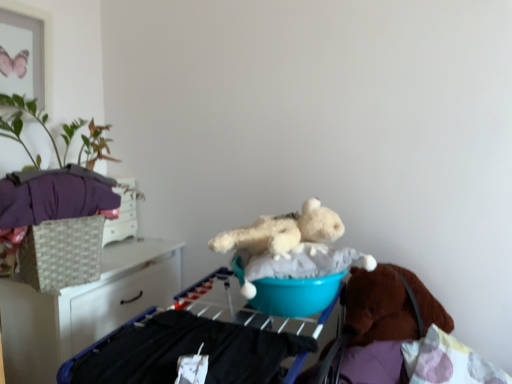
Question: Is teal plastic bucket at center a part of blue plastic basin at center?

Choices:
 (A) no
 (B) yes

Answer: (A)

Question: Is blue plastic basin at center beside teal plastic bucket at center?

Choices:
 (A) yes
 (B) no

Answer: (B)

Question: Considering the relative sizes of blue plastic basin at center and teal plastic bucket at center in the image provided, is blue plastic basin at center bigger than teal plastic bucket at center?

Choices:
 (A) yes
 (B) no

Answer: (B)

Question: Are blue plastic basin at center and teal plastic bucket at center located far from each other?

Choices:
 (A) yes
 (B) no

Answer: (B)

Question: From the image's perspective, is blue plastic basin at center on top of teal plastic bucket at center?

Choices:
 (A) yes
 (B) no

Answer: (A)

Question: From a real-world perspective, is blue plastic basin at center positioned over teal plastic bucket at center based on gravity?

Choices:
 (A) yes
 (B) no

Answer: (A)

Question: Is fluffy white teddy bear at center inside blue plastic basin at center?

Choices:
 (A) no
 (B) yes

Answer: (B)

Question: Is blue plastic basin at center positioned with its back to fluffy white teddy bear at center?

Choices:
 (A) no
 (B) yes

Answer: (A)

Question: Considering the relative sizes of blue plastic basin at center and fluffy white teddy bear at center in the image provided, is blue plastic basin at center smaller than fluffy white teddy bear at center?

Choices:
 (A) yes
 (B) no

Answer: (B)

Question: Is blue plastic basin at center with fluffy white teddy bear at center?

Choices:
 (A) yes
 (B) no

Answer: (A)

Question: Does blue plastic basin at center have a lesser width compared to fluffy white teddy bear at center?

Choices:
 (A) yes
 (B) no

Answer: (B)

Question: Is blue plastic basin at center at the left side of fluffy white teddy bear at center?

Choices:
 (A) no
 (B) yes

Answer: (B)

Question: Is white wicker basket at left surrounding fluffy white teddy bear at center?

Choices:
 (A) yes
 (B) no

Answer: (B)